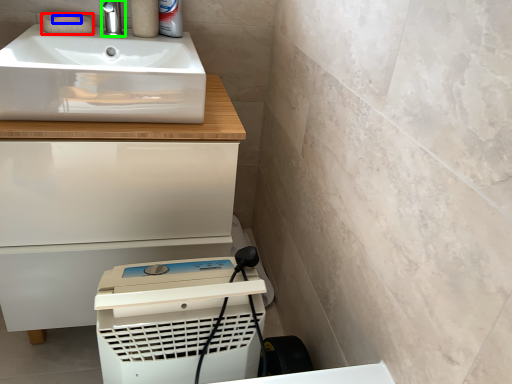
Question: Which object is the closest to the soap (highlighted by a red box)? Choose among these: soap (highlighted by a blue box) or tap (highlighted by a green box).

Choices:
 (A) soap
 (B) tap

Answer: (A)